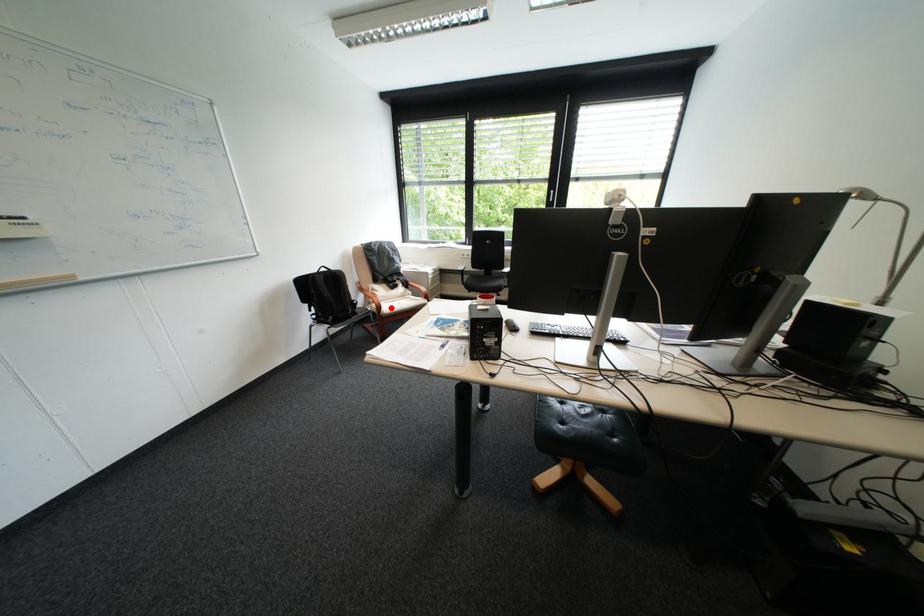
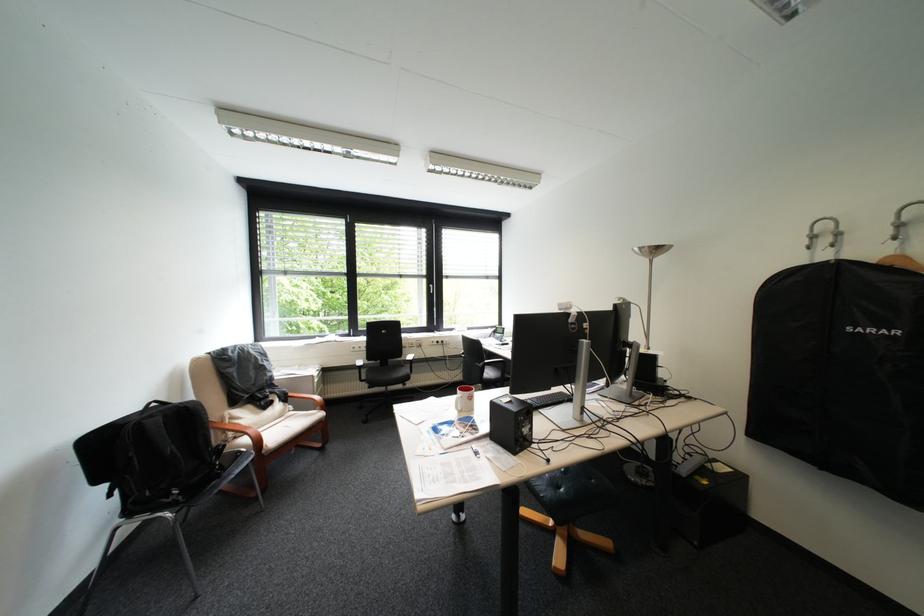
Locate, in the second image, the point that corresponds to the highlighted location in the first image.

(271, 443)